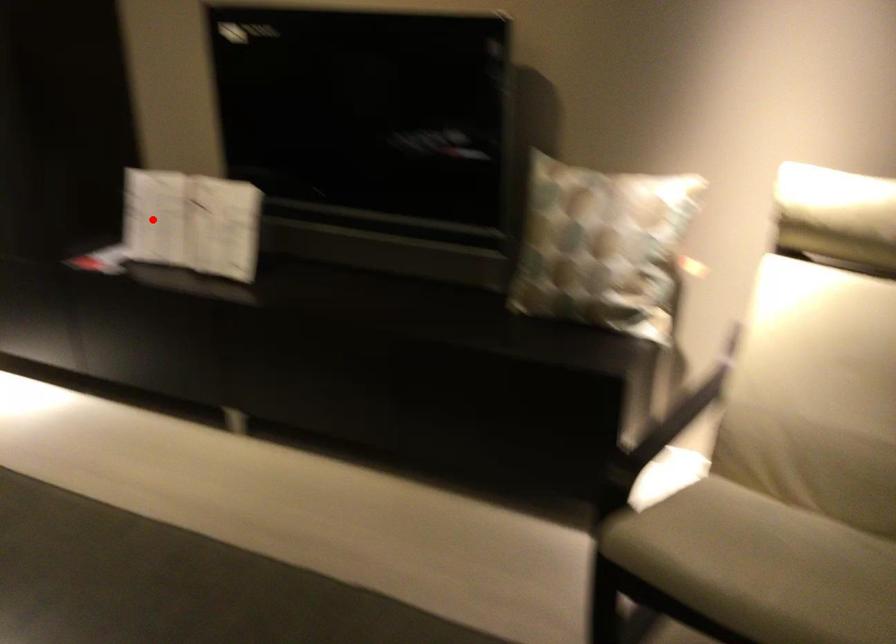
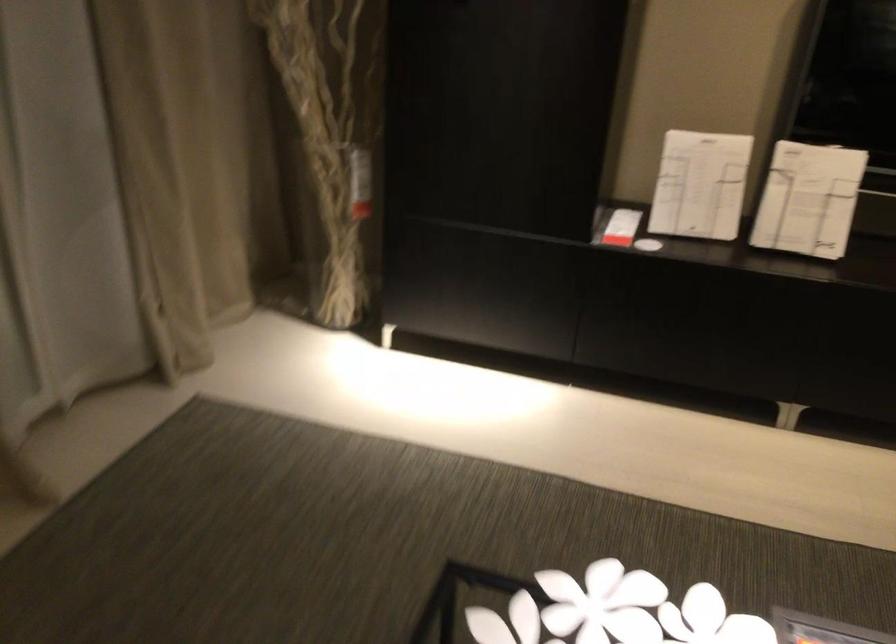
The point at the highlighted location is marked in the first image. Where is the corresponding point in the second image?

(700, 185)